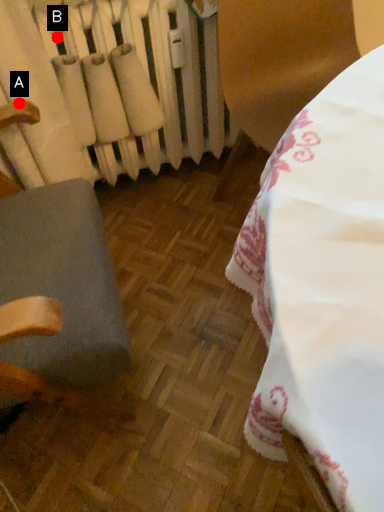
Question: Two points are circled on the image, labeled by A and B beside each circle. Which point is closer to the camera taking this photo?

Choices:
 (A) A is closer
 (B) B is closer

Answer: (A)